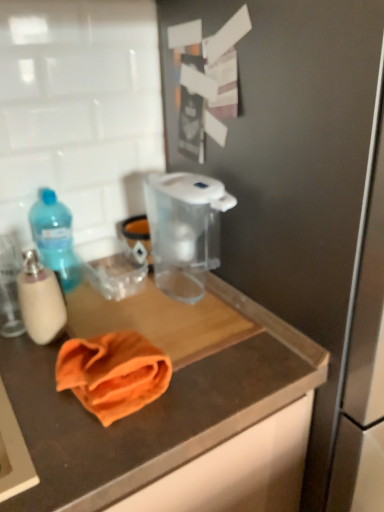
Find the location of a particular element. The width and height of the screenshot is (384, 512). vacant space to the left of transparent plastic pitcher at center is located at coordinates (117, 304).